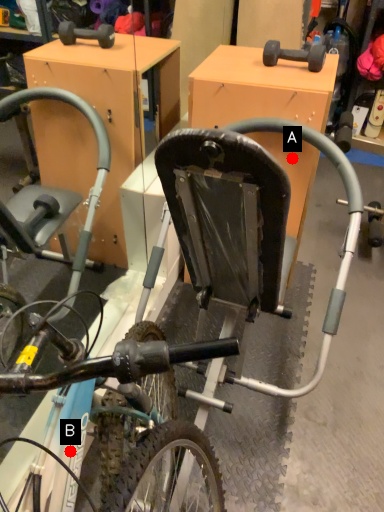
Question: Two points are circled on the image, labeled by A and B beside each circle. Which point is farther from the camera taking this photo?

Choices:
 (A) A is further
 (B) B is further

Answer: (A)